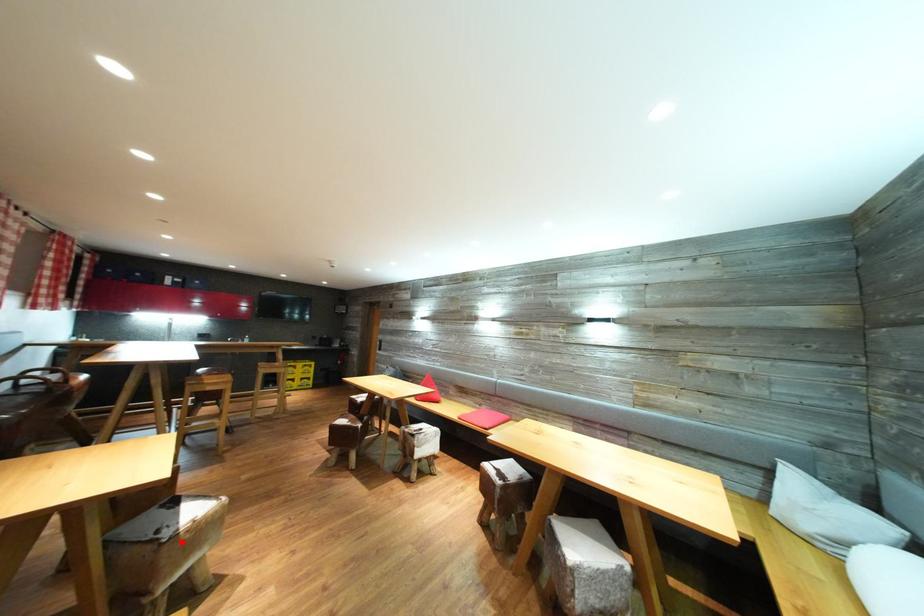
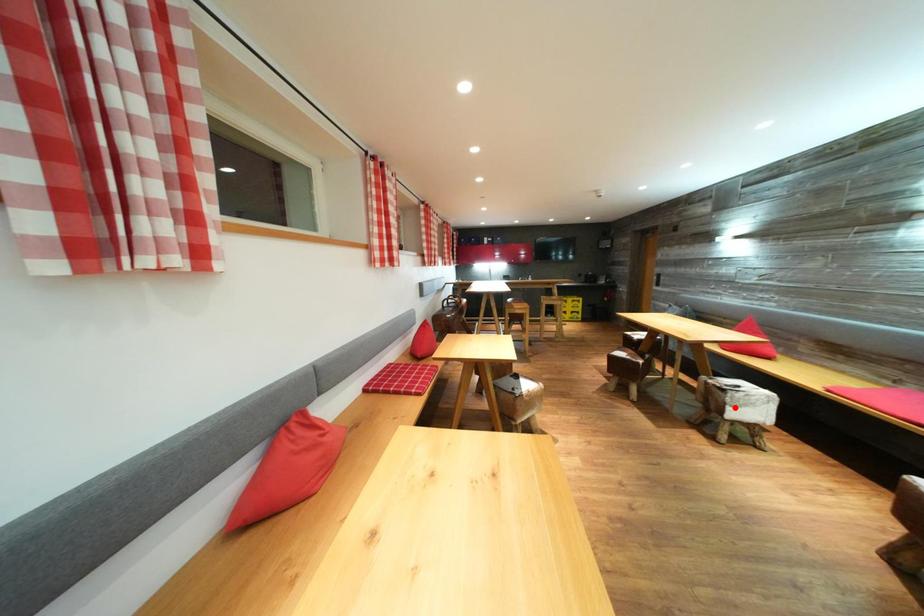
I am providing you with two images of the same scene from different viewpoints. A red point is marked on the first image and another point is marked on the second image. Is the red point in image1 aligned with the point shown in image2?

No